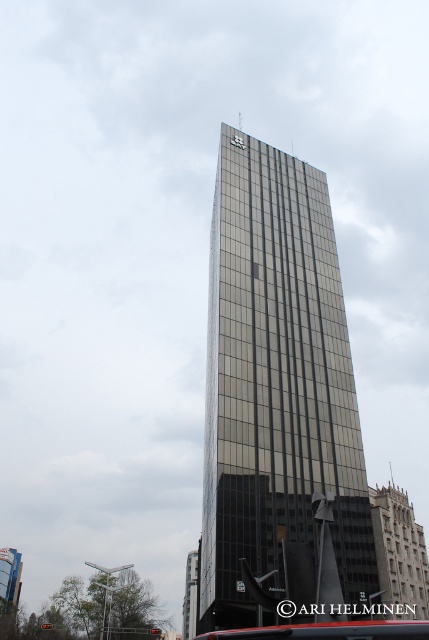
You are standing at the base of the skyscraper and looking upwards. There are two points marked on the building. The first point is at coordinates point (281, 292) and the second point is at point (349, 632). Which point is closer to the top of the skyscraper?

Point (349, 632) is closer to the top of the skyscraper because it has a higher y coordinate value than point (281, 292).

You are standing on the sidewalk in front of the skyscraper and see the reflective glass tower at center and the metallic bus at center. Which object is positioned to the left when viewed from your perspective?

The reflective glass tower at center is to the left of the metallic bus at center, so it is positioned to the left when viewed from your perspective.

You are standing on the sidewalk and see the reflective glass tower at center and the metallic bus at center. Which object is closer to you?

The reflective glass tower at center is closer to you because it is further to the viewer than the metallic bus at center.